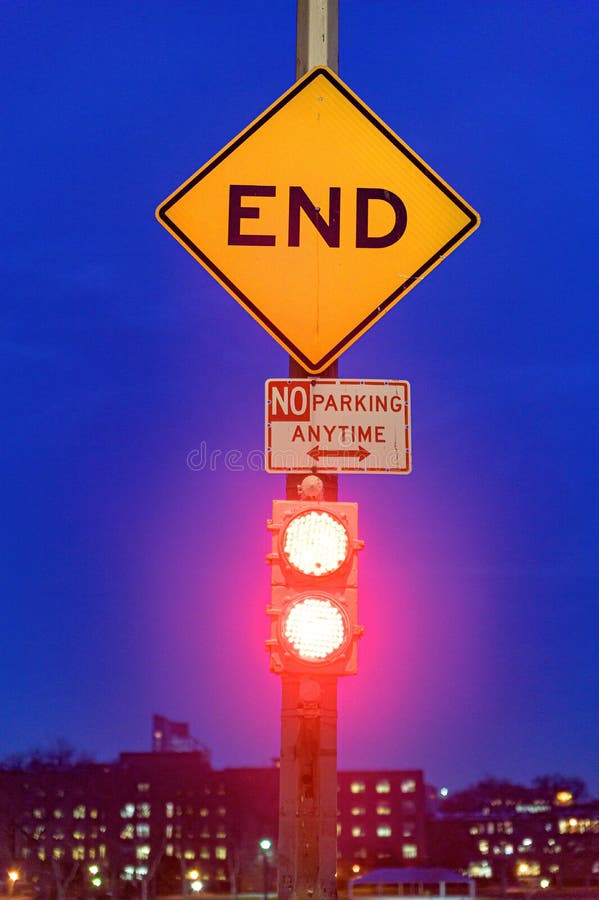
This screenshot has width=599, height=900. I want to click on led, so click(x=314, y=549).